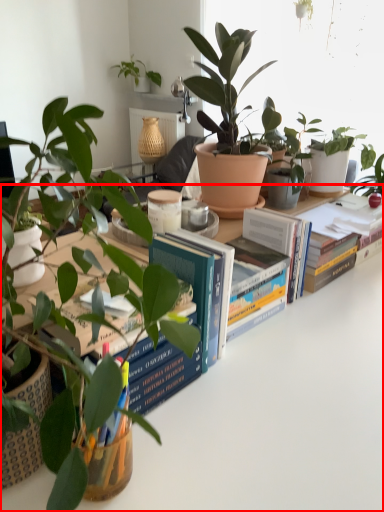
Question: Considering the relative positions of table (annotated by the red box) and paperback book in the image provided, where is table (annotated by the red box) located with respect to the staircase?

Choices:
 (A) right
 (B) left

Answer: (A)